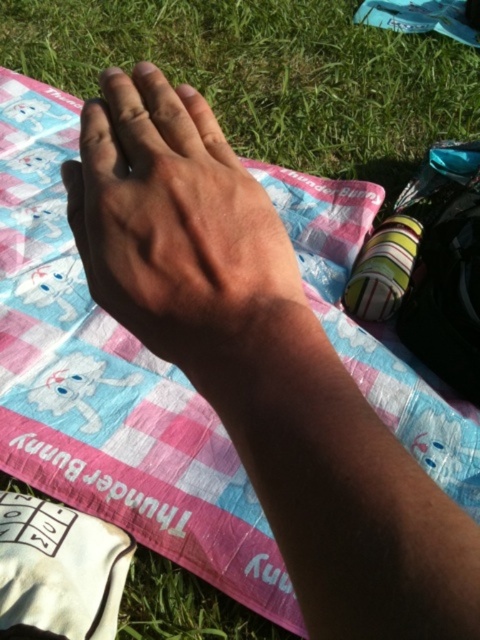
Does green grass at upper center appear on the left side of dry skin hand at center?

In fact, green grass at upper center is to the right of dry skin hand at center.

Is green grass at upper center positioned in front of dry skin hand at center?

No, it is behind dry skin hand at center.

Which is behind, point (240, 154) or point (106, 248)?

The point (240, 154) is more distant.

Locate an element on the screen. This screenshot has width=480, height=640. green grass at upper center is located at coordinates (268, 74).